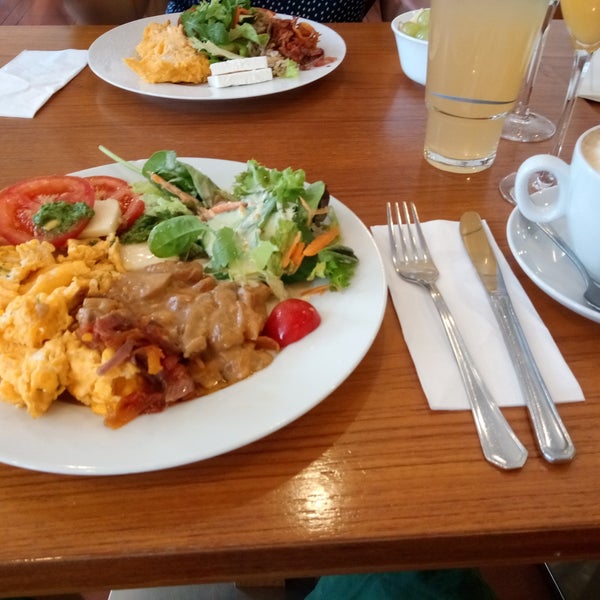
Where is `utensil`? This screenshot has height=600, width=600. utensil is located at coordinates (592, 286), (514, 336), (454, 350).